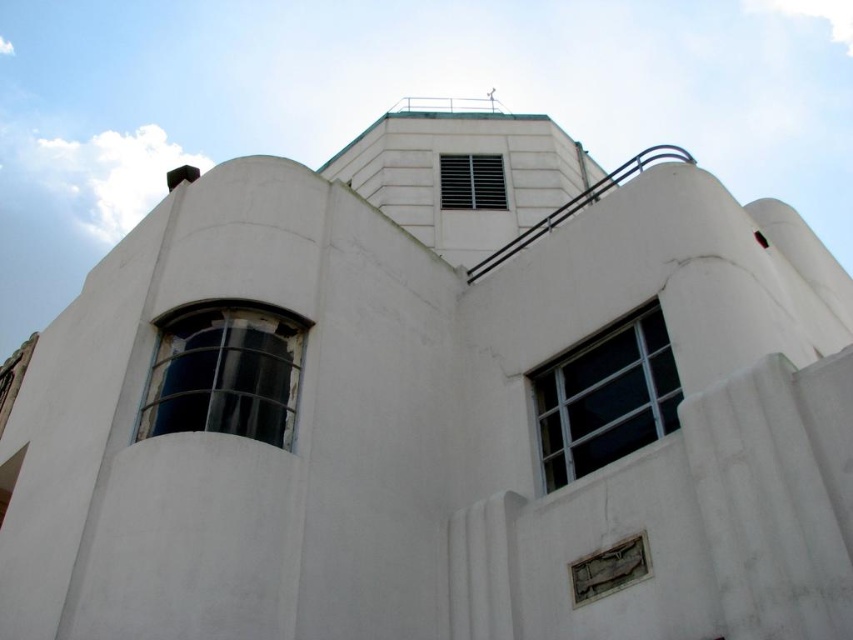
You are an architect analyzing the building facade. You need to determine which object between the clear glass window at upper right and the metallic grid vent at upper center occupies more horizontal space. Based on the building design, which one is wider?

The clear glass window at upper right has a lesser width compared to the metallic grid vent at upper center, so the metallic grid vent at upper center is wider.

What object is located at the coordinate point (x=225, y=372) in the image?

The point (x=225, y=372) corresponds to the dark glass window at left.

You are a window cleaner standing on the ground floor looking up at the building. You need to clean both the dark glass window at left and the metallic grid vent at upper center. Which object will you reach first as you climb the ladder?

The dark glass window at left will be reached first because it is in front of the metallic grid vent at upper center, meaning it is closer to you.